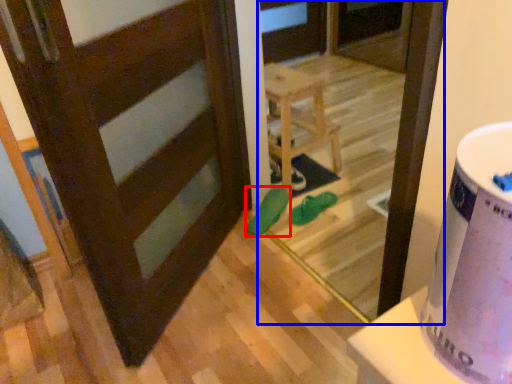
Question: Which point is further to the camera, footwear (highlighted by a red box) or screen door (highlighted by a blue box)?

Choices:
 (A) footwear
 (B) screen door

Answer: (A)